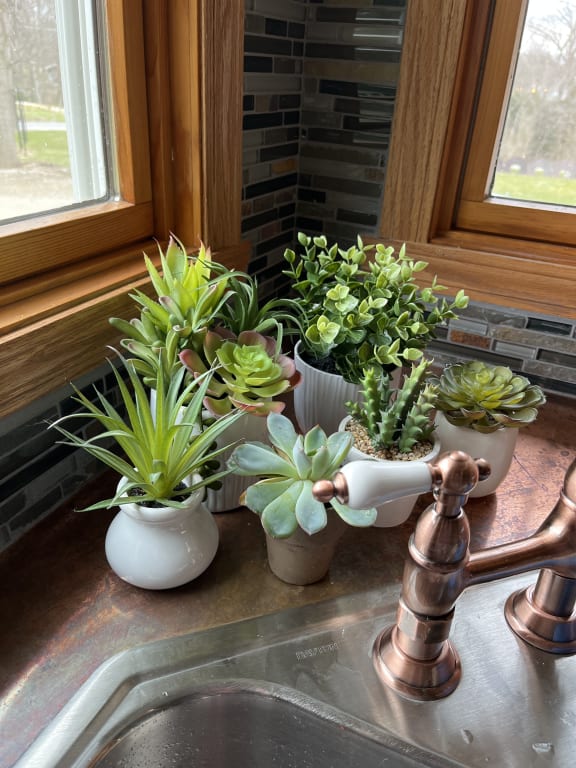
Where is `faucet handle`? This screenshot has width=576, height=768. faucet handle is located at coordinates (394, 482).